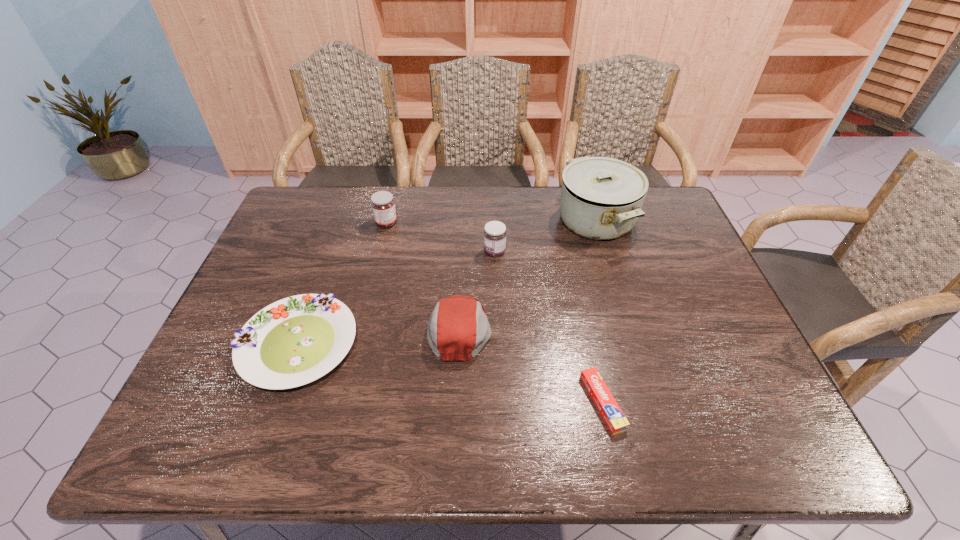
You are a GUI agent. You are given a task and a screenshot of the screen. Output one action in this format:
    pyautogui.click(x=<x>, y=<y>)
    Task: Click on the vacant space that's between the saucepan and the salad plate
    This screenshot has width=960, height=540.
    Given the screenshot: What is the action you would take?
    pyautogui.click(x=446, y=283)

Identify the location of blank region between the nearer jam and the cap. This screenshot has width=960, height=540. (477, 291).

Locate an element on the screen. Image resolution: width=960 pixels, height=540 pixels. free spot between the right jam and the left jam is located at coordinates [x=441, y=238].

What are the coordinates of `empty space that is in between the right jam and the saucepan` in the screenshot? It's located at (545, 237).

Find the location of a particular element. The height and width of the screenshot is (540, 960). blank region between the saucepan and the second shortest object is located at coordinates (446, 283).

The height and width of the screenshot is (540, 960). Find the location of `free spot between the farther jam and the cap`. free spot between the farther jam and the cap is located at coordinates (423, 276).

Locate an element on the screen. The width and height of the screenshot is (960, 540). vacant region between the tallest object and the cap is located at coordinates (528, 275).

What are the coordinates of `vacant space in between the saucepan and the shortest object` in the screenshot? It's located at coord(599,312).

Image resolution: width=960 pixels, height=540 pixels. What are the coordinates of `the fourth closest object to the shortest object` in the screenshot? It's located at (294, 341).

This screenshot has height=540, width=960. What are the coordinates of `object that is the fifth closest to the nearer jam` in the screenshot? It's located at click(613, 416).